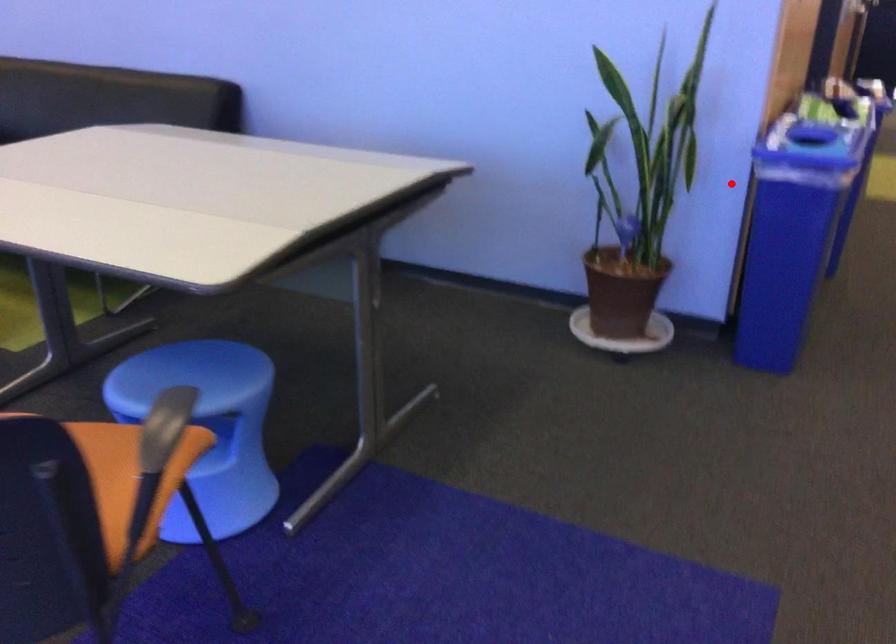
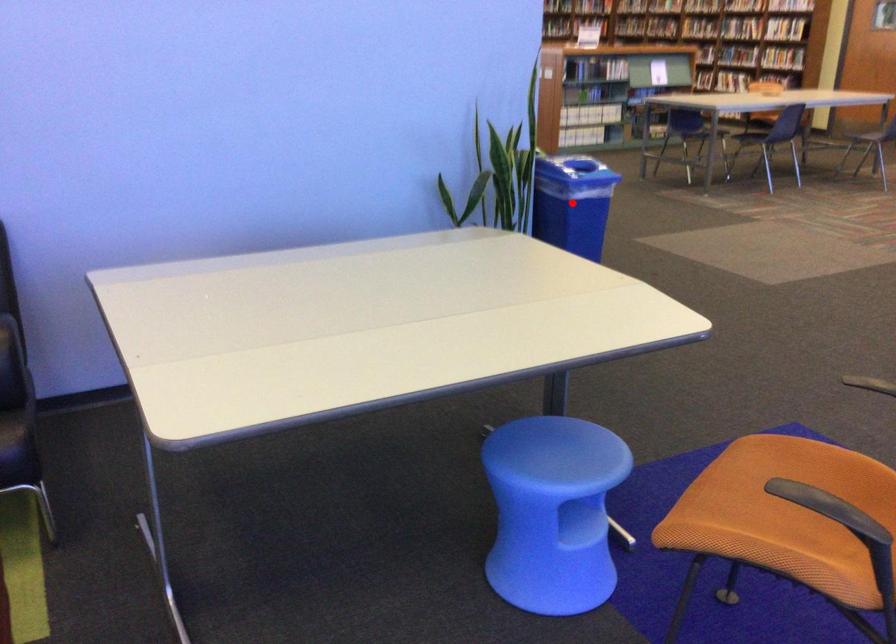
I am providing you with two images of the same scene from different viewpoints. A red point is marked on the first image and another point is marked on the second image. Are the points marked in image1 and image2 representing the same 3D position?

Yes